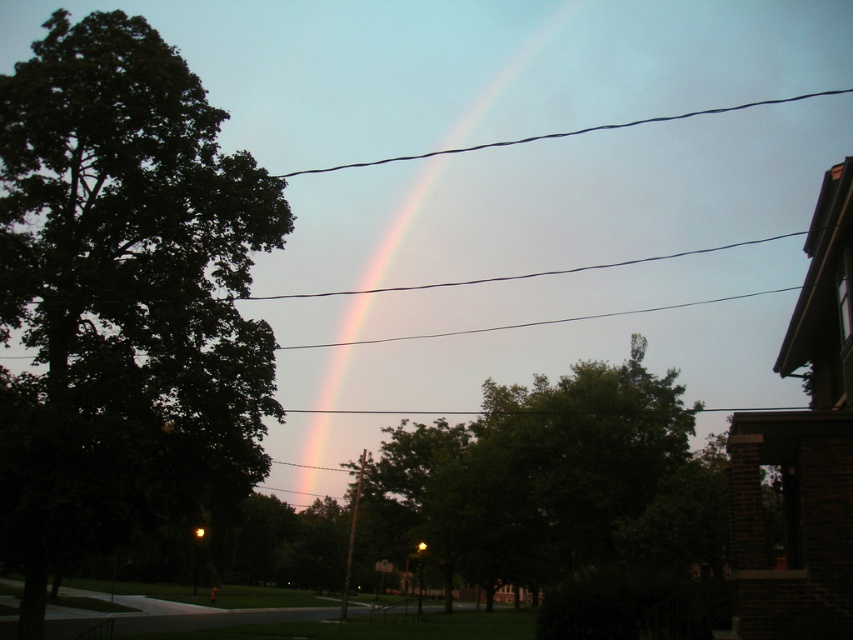
Does green leafy tree at left have a greater height compared to rainbow at center?

No.

Between green leafy tree at left and rainbow at center, which one has more height?

rainbow at center is taller.

Between point (93, 442) and point (506, 291), which one is positioned behind?

Point (506, 291)

Where is `green leafy tree at left`? The image size is (853, 640). green leafy tree at left is located at coordinates (122, 296).

Can you confirm if green leafy tree at left is positioned above black wire at upper center?

Actually, green leafy tree at left is below black wire at upper center.

Who is shorter, green leafy tree at left or black wire at upper center?

Standing shorter between the two is green leafy tree at left.

Locate an element on the screen. green leafy tree at left is located at coordinates (122, 296).

Who is positioned more to the left, rainbow at center or black wire at upper center?

rainbow at center is more to the left.

Can you confirm if rainbow at center is positioned below black wire at upper center?

Correct, rainbow at center is located below black wire at upper center.

What do you see at coordinates (450, 218) in the screenshot? I see `rainbow at center` at bounding box center [450, 218].

Locate an element on the screen. This screenshot has height=640, width=853. rainbow at center is located at coordinates (450, 218).